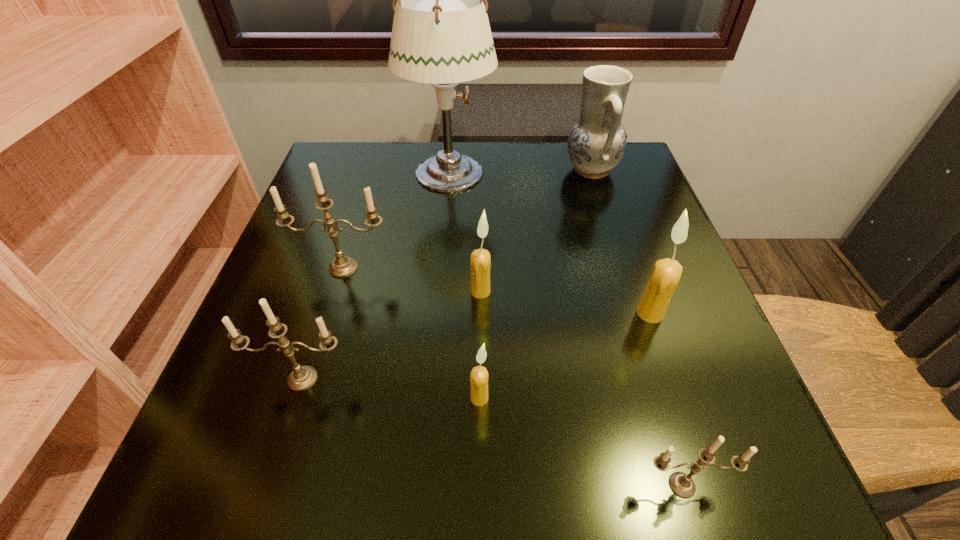
I want to click on free space at the far left corner of the desktop, so click(320, 168).

You are a GUI agent. You are given a task and a screenshot of the screen. Output one action in this format:
    pyautogui.click(x=<x>, y=<y>)
    Task: Click on the vacant space at the far right corner of the desktop
    This screenshot has height=540, width=960.
    Given the screenshot: What is the action you would take?
    [626, 197]

The width and height of the screenshot is (960, 540). In order to click on vacant point located between the lampshade and the second farthest candle in this screenshot , I will do `click(465, 233)`.

The height and width of the screenshot is (540, 960). Identify the location of vacant region between the tallest object and the blue pottery. [x=520, y=172].

Locate an element on the screen. The height and width of the screenshot is (540, 960). vacant space that's between the nearest candle and the pottery is located at coordinates (636, 327).

Locate an element on the screen. free spot between the tallest object and the second farthest cream candle is located at coordinates 550,244.

The height and width of the screenshot is (540, 960). Identify the location of free space between the lampshade and the nearest metallic candle. 565,329.

You are a GUI agent. You are given a task and a screenshot of the screen. Output one action in this format:
    pyautogui.click(x=<x>, y=<y>)
    Task: Click on the empty space between the blue pottery and the smallest metallic candle
    This screenshot has height=540, width=960.
    Given the screenshot: What is the action you would take?
    pyautogui.click(x=636, y=327)

Where is `free space between the farthest cream candle and the smallest cream candle`? Image resolution: width=960 pixels, height=540 pixels. free space between the farthest cream candle and the smallest cream candle is located at coordinates point(480,345).

In order to click on vacant space that's between the second smallest metallic candle and the nearest metallic candle in this screenshot , I will do `click(492, 432)`.